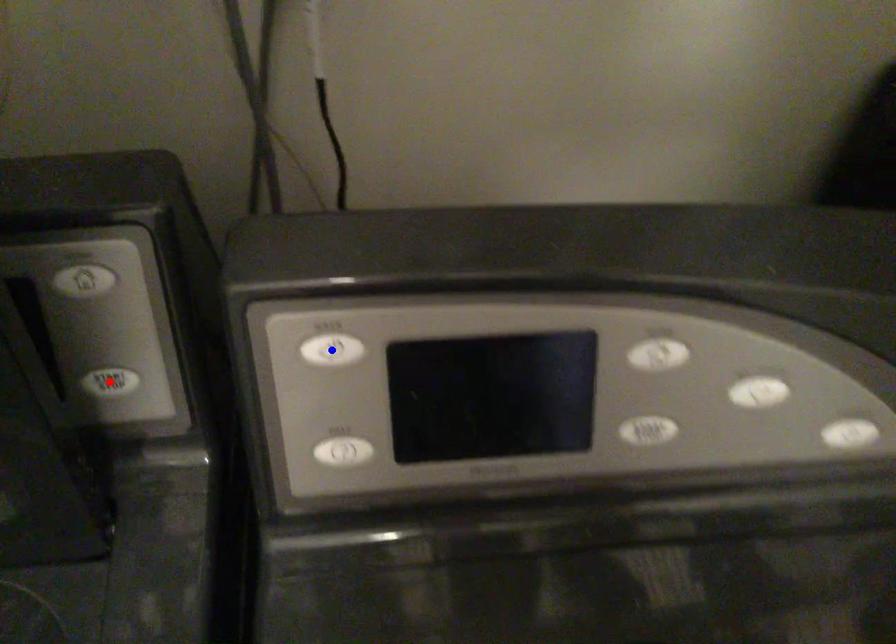
Question: Two points are marked on the image. Which point is closer to the camera?

Choices:
 (A) Blue point is closer.
 (B) Red point is closer.

Answer: (A)